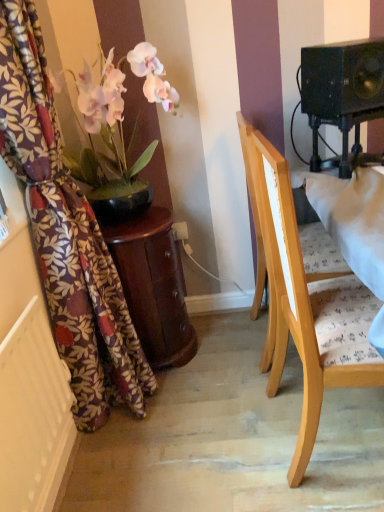
At what (x,y) coordinates should I click in order to perform the action: click on vacant space to the right of floral fabric curtain at left. Please return your answer as a coordinate pair (x, y). Image resolution: width=384 pixels, height=512 pixels. Looking at the image, I should click on [x=211, y=413].